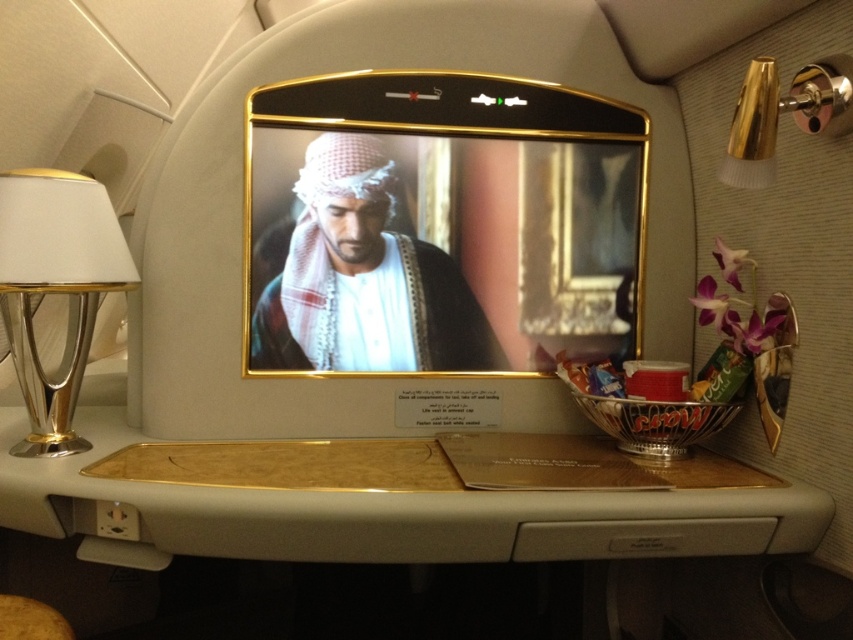
Is point (281, 528) in front of point (70, 628)?

No, (281, 528) is further to viewer.

Between gold wood tray at center and wooden stool at lower left, which one is positioned lower?

wooden stool at lower left is lower down.

Is point (287, 557) closer to viewer compared to point (25, 612)?

No, (287, 557) is further to viewer.

This screenshot has width=853, height=640. Identify the location of gold wood tray at center. (390, 509).

Is point (314, 241) behind point (831, 72)?

Yes.

Which is behind, point (317, 308) or point (817, 72)?

The point (317, 308) is behind.

Is point (305, 182) positioned in front of point (773, 76)?

That is False.

Image resolution: width=853 pixels, height=640 pixels. What are the coordinates of `matte white headscarf at center` in the screenshot? It's located at (364, 280).

Is gold wood tray at center positioned before gold metallic lamp at upper right?

That is False.

Who is more distant from viewer, (x=477, y=512) or (x=770, y=176)?

Positioned behind is point (x=477, y=512).

Identify the location of gold wood tray at center. Image resolution: width=853 pixels, height=640 pixels. (390, 509).